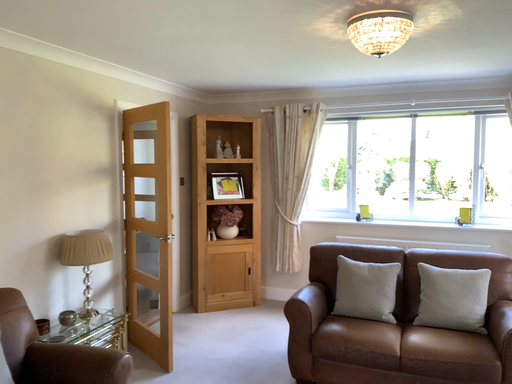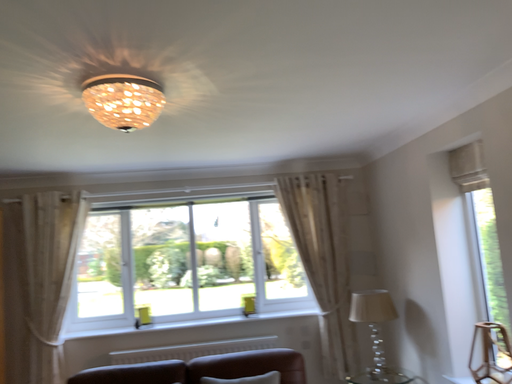
Question: Which way did the camera rotate in the video?

Choices:
 (A) rotated right
 (B) rotated left

Answer: (A)